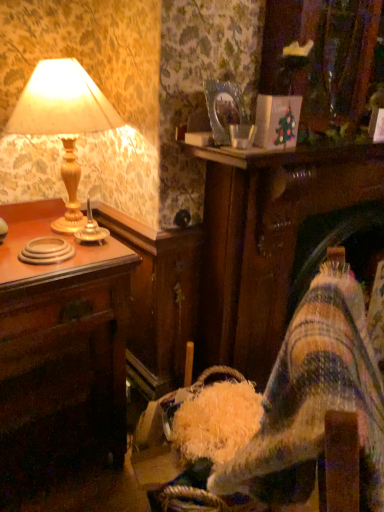
Question: Does wooden desk at left have a smaller size compared to gold metallic candle holder at left?

Choices:
 (A) yes
 (B) no

Answer: (B)

Question: Is wooden desk at left oriented away from gold metallic candle holder at left?

Choices:
 (A) no
 (B) yes

Answer: (A)

Question: Does wooden desk at left appear on the right side of gold metallic candle holder at left?

Choices:
 (A) no
 (B) yes

Answer: (A)

Question: Is wooden desk at left shorter than gold metallic candle holder at left?

Choices:
 (A) no
 (B) yes

Answer: (A)

Question: Is wooden desk at left far away from gold metallic candle holder at left?

Choices:
 (A) yes
 (B) no

Answer: (B)

Question: Is wooden desk at left situated inside matte gold lamp at left or outside?

Choices:
 (A) inside
 (B) outside

Answer: (B)

Question: Considering the positions of wooden desk at left and matte gold lamp at left in the image, is wooden desk at left wider or thinner than matte gold lamp at left?

Choices:
 (A) thin
 (B) wide

Answer: (B)

Question: From the image's perspective, is wooden desk at left positioned above or below matte gold lamp at left?

Choices:
 (A) below
 (B) above

Answer: (A)

Question: Is wooden desk at left to the left or to the right of matte gold lamp at left in the image?

Choices:
 (A) right
 (B) left

Answer: (B)

Question: Is wooden desk at left inside or outside of gold metallic candle holder at left?

Choices:
 (A) inside
 (B) outside

Answer: (B)

Question: Based on their sizes in the image, would you say wooden desk at left is bigger or smaller than gold metallic candle holder at left?

Choices:
 (A) big
 (B) small

Answer: (A)

Question: Considering their positions, is wooden desk at left located in front of or behind gold metallic candle holder at left?

Choices:
 (A) front
 (B) behind

Answer: (A)

Question: Looking at their shapes, would you say wooden desk at left is wider or thinner than gold metallic candle holder at left?

Choices:
 (A) thin
 (B) wide

Answer: (B)

Question: Is gold metallic candle holder at left inside the boundaries of matte gold lamp at left, or outside?

Choices:
 (A) inside
 (B) outside

Answer: (A)

Question: In terms of height, does gold metallic candle holder at left look taller or shorter compared to matte gold lamp at left?

Choices:
 (A) short
 (B) tall

Answer: (A)